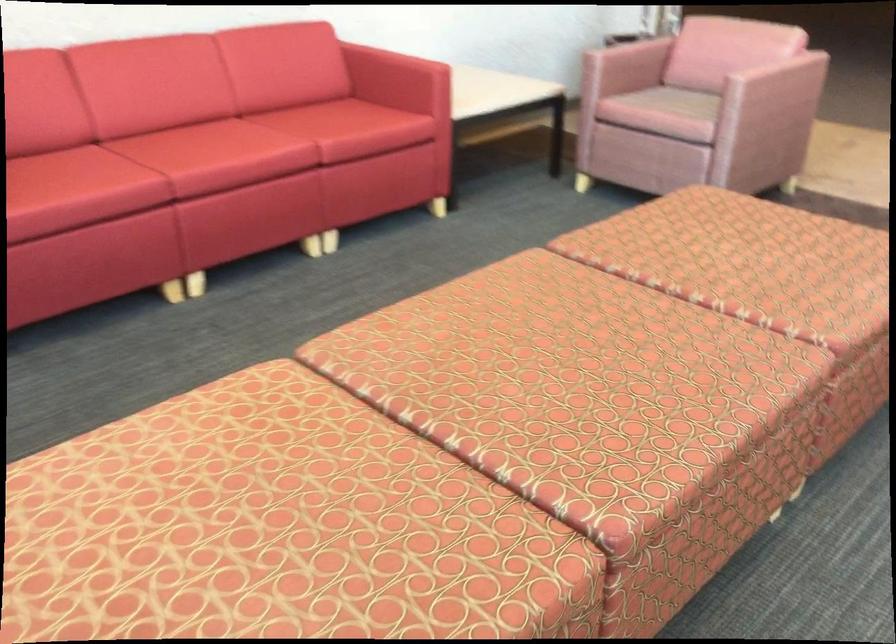
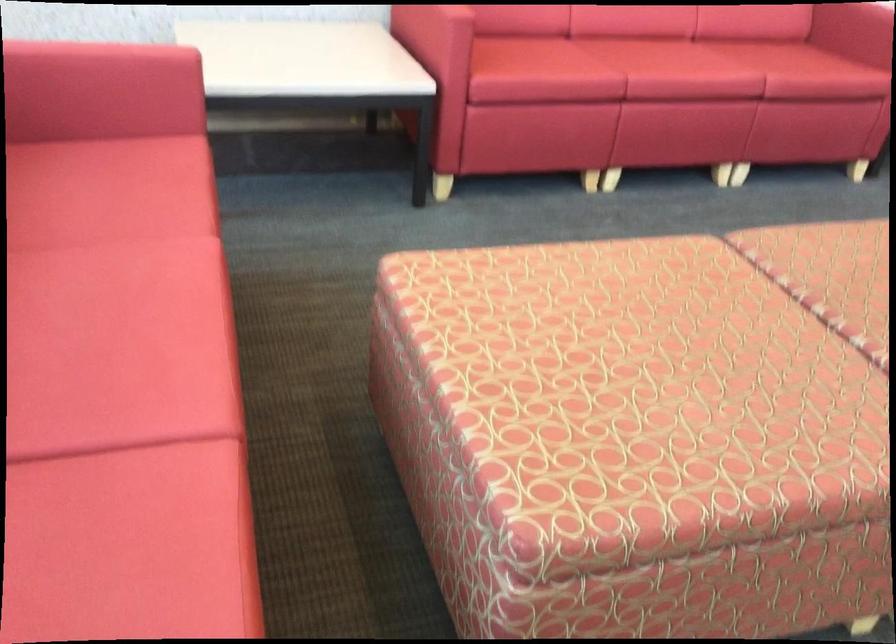
In the second image, find the point that corresponds to point (225, 146) in the first image.

(677, 62)